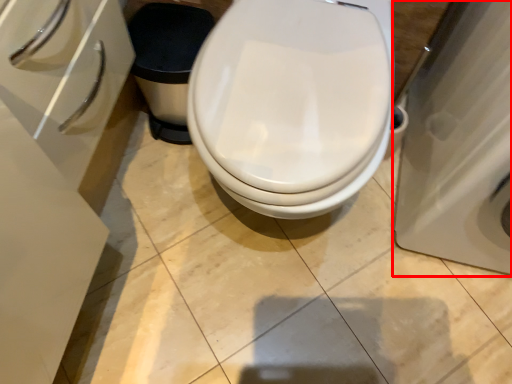
Question: Considering the relative positions of porcelain (annotated by the red box) and toilet in the image provided, where is porcelain (annotated by the red box) located with respect to the staircase?

Choices:
 (A) right
 (B) left

Answer: (A)